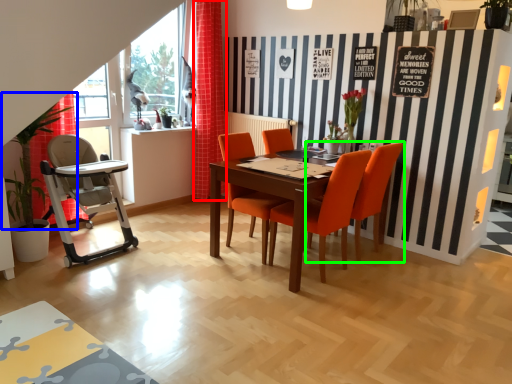
Question: Estimate the real-world distances between objects in this image. Which object is closer to curtain (highlighted by a red box), plant (highlighted by a blue box) or chair (highlighted by a green box)?

Choices:
 (A) plant
 (B) chair

Answer: (A)